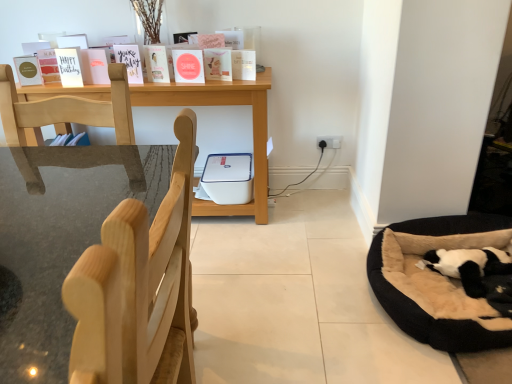
Identify the location of free space in front of matte white paperback book at center, which appears as the 4th paperback book when viewed from the right. This screenshot has width=512, height=384. (164, 83).